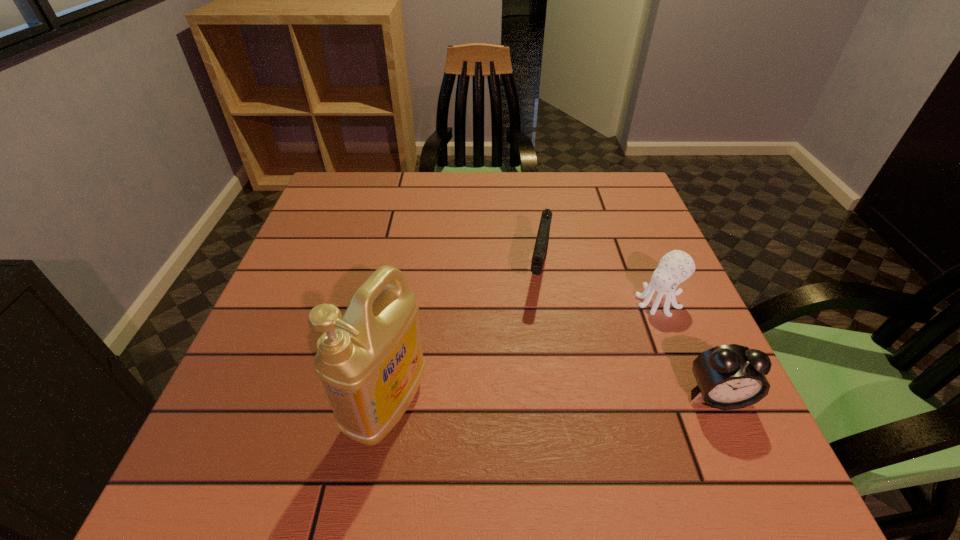
Find the location of a particular element. This screenshot has width=960, height=540. vacant area that lies between the pistol and the leftmost object is located at coordinates click(x=463, y=339).

In order to click on empty space that is in between the octopus and the detergent in this screenshot , I will do `click(523, 353)`.

Identify the location of empty location between the alarm clock and the second object from left to right. This screenshot has height=540, width=960. (628, 334).

Locate an element on the screen. Image resolution: width=960 pixels, height=540 pixels. unoccupied position between the third object from right to left and the alarm clock is located at coordinates (628, 334).

Locate an element on the screen. This screenshot has height=540, width=960. object that is the closest to the leftmost object is located at coordinates (541, 245).

Locate which object is the second closest to the detergent. Please provide its 2D coordinates. Your answer should be formatted as a tuple, i.e. [(x, y)], where the tuple contains the x and y coordinates of a point satisfying the conditions above.

[(675, 267)]

Identify the location of vacant space that satisfies the following two spatial constraints: 1. on the front side of the octopus; 2. on the right side of the pistol. (542, 301).

Image resolution: width=960 pixels, height=540 pixels. Identify the location of vacant area in the image that satisfies the following two spatial constraints: 1. on the front side of the pistol; 2. on the right side of the octopus. pos(542,301).